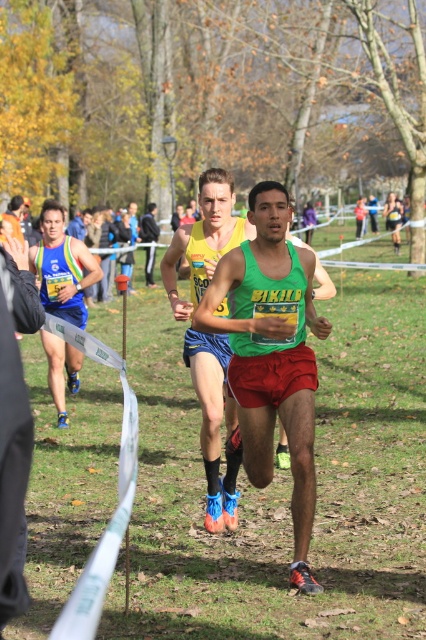
Question: Does green matte tank top at center appear under matte blue shorts at left?

Choices:
 (A) no
 (B) yes

Answer: (B)

Question: Which object appears closest to the camera in this image?

Choices:
 (A) matte blue shorts at left
 (B) green matte tank top at center

Answer: (B)

Question: Is green matte tank top at center wider than matte blue shorts at left?

Choices:
 (A) yes
 (B) no

Answer: (B)

Question: Which point is closer to the camera taking this photo?

Choices:
 (A) (57, 340)
 (B) (210, 410)

Answer: (B)

Question: Can you confirm if green matte tank top at center is wider than matte blue shorts at left?

Choices:
 (A) yes
 (B) no

Answer: (B)